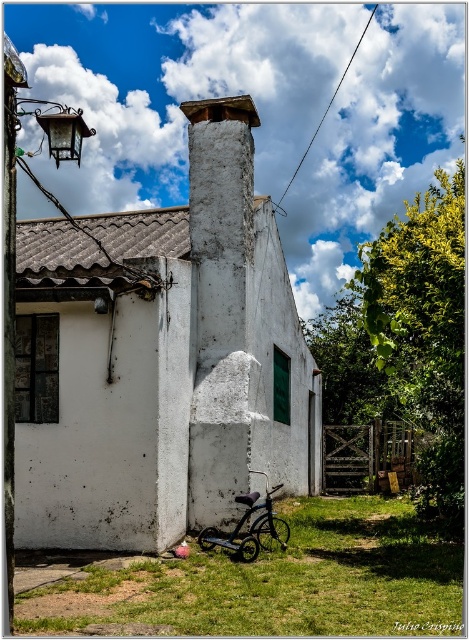
You are standing in front of the house and want to take a photo. There are two points marked on the ground in front of you. The first point is at coordinate point(x=232, y=579) and the second point is at coordinate point(x=234, y=369). Which point is closer to your current position?

Point(x=232, y=579) is closer to the camera than point(x=234, y=369), so the first point is closer to your current position.

You are standing in front of the house and want to move from the shiny black bicycle at lower center to the white rough concrete chimney at center. Which direction should you move to get closer to the chimney?

To get closer to the white rough concrete chimney at center, you should move forward since the chimney is further away from you than the shiny black bicycle at lower center.